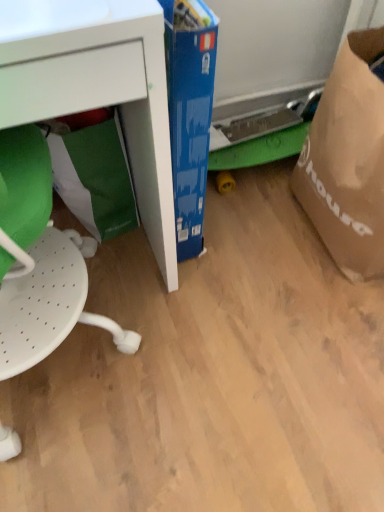
Question: Could white perforated swivel chair at left be considered to be inside white matte desk at lower left?

Choices:
 (A) yes
 (B) no

Answer: (A)

Question: From the image's perspective, would you say white matte desk at lower left is shown under white perforated swivel chair at left?

Choices:
 (A) no
 (B) yes

Answer: (A)

Question: Is white matte desk at lower left behind white perforated swivel chair at left?

Choices:
 (A) yes
 (B) no

Answer: (A)

Question: Can you confirm if white matte desk at lower left is positioned to the left of white perforated swivel chair at left?

Choices:
 (A) no
 (B) yes

Answer: (B)

Question: From a real-world perspective, is white matte desk at lower left located beneath white perforated swivel chair at left?

Choices:
 (A) yes
 (B) no

Answer: (A)

Question: Considering the relative sizes of white matte desk at lower left and white perforated swivel chair at left in the image provided, is white matte desk at lower left bigger than white perforated swivel chair at left?

Choices:
 (A) no
 (B) yes

Answer: (B)

Question: Is white matte desk at lower left outside brown paper grocery bag at right, which is the 2th grocery bag in left-to-right order?

Choices:
 (A) yes
 (B) no

Answer: (A)

Question: Is white matte desk at lower left positioned behind brown paper grocery bag at right, which is the 2th grocery bag in left-to-right order?

Choices:
 (A) no
 (B) yes

Answer: (A)

Question: Can you confirm if white matte desk at lower left is thinner than brown paper grocery bag at right, which is the 2th grocery bag in left-to-right order?

Choices:
 (A) yes
 (B) no

Answer: (B)

Question: Is white matte desk at lower left touching brown paper grocery bag at right, which is counted as the first grocery bag, starting from the right?

Choices:
 (A) yes
 (B) no

Answer: (B)

Question: Considering the relative sizes of white matte desk at lower left and brown paper grocery bag at right, which is the 2th grocery bag in left-to-right order, in the image provided, is white matte desk at lower left smaller than brown paper grocery bag at right, which is the 2th grocery bag in left-to-right order,?

Choices:
 (A) no
 (B) yes

Answer: (A)

Question: Is white matte desk at lower left wider than brown paper grocery bag at right, which is counted as the first grocery bag, starting from the right?

Choices:
 (A) yes
 (B) no

Answer: (A)

Question: Is brown paper grocery bag at right, which is counted as the first grocery bag, starting from the right, far from white perforated swivel chair at left?

Choices:
 (A) yes
 (B) no

Answer: (B)